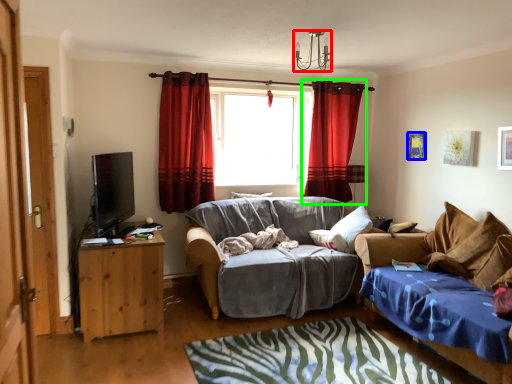
Question: Which is farther away from lamp (highlighted by a red box)? picture frame (highlighted by a blue box) or curtain (highlighted by a green box)?

Choices:
 (A) picture frame
 (B) curtain

Answer: (A)